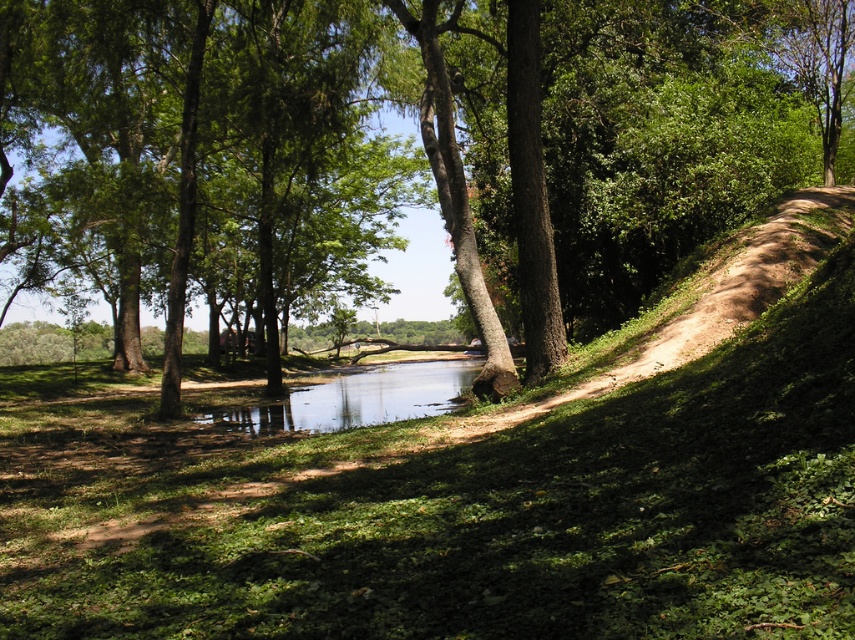
Can you confirm if green grassy hillside at lower right is thinner than green leafy tree at center?

Correct, green grassy hillside at lower right's width is less than green leafy tree at center's.

Can you confirm if green grassy hillside at lower right is bigger than green leafy tree at center?

No, green grassy hillside at lower right is not bigger than green leafy tree at center.

Who is more forward, (789, 268) or (516, 170)?

Point (789, 268) is more forward.

Where is `green grassy hillside at lower right`? This screenshot has width=855, height=640. green grassy hillside at lower right is located at coordinates (475, 484).

Can you confirm if green leafy tree at center is smaller than clear water at center?

Actually, green leafy tree at center might be larger than clear water at center.

Can you confirm if green leafy tree at center is shorter than clear water at center?

No, green leafy tree at center is not shorter than clear water at center.

Does point (706, 195) lie in front of point (349, 392)?

Yes, point (706, 195) is in front of point (349, 392).

This screenshot has width=855, height=640. Identify the location of green leafy tree at center. (422, 144).

Between point (604, 602) and point (345, 387), which one is positioned in front?

Point (604, 602)

What do you see at coordinates (475, 484) in the screenshot?
I see `green grassy hillside at lower right` at bounding box center [475, 484].

Image resolution: width=855 pixels, height=640 pixels. What are the coordinates of `green grassy hillside at lower right` in the screenshot? It's located at (475, 484).